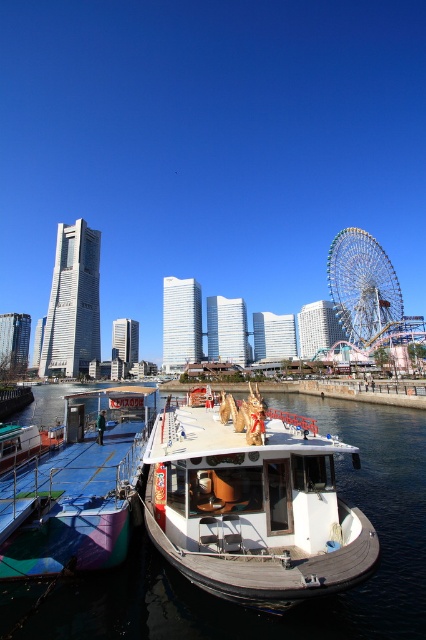
Can you confirm if white matte boat at center is thinner than metallic silver ferris wheel at right?

Yes.

Between point (313, 445) and point (402, 320), which one is positioned behind?

Positioned behind is point (402, 320).

Image resolution: width=426 pixels, height=640 pixels. Find the location of `white matte boat at center`. white matte boat at center is located at coordinates (253, 504).

Is white matte boat at center thinner than multicolored painted boat at lower left?

Indeed, white matte boat at center has a lesser width compared to multicolored painted boat at lower left.

Find the location of `white matte boat at center`. white matte boat at center is located at coordinates pos(253,504).

Is point (192, 520) closer to camera compared to point (11, 573)?

No, it is behind (11, 573).

Find the location of a particular element. white matte boat at center is located at coordinates (253, 504).

Which is behind, point (104, 540) or point (368, 257)?

Positioned behind is point (368, 257).

Which of these two, multicolored painted boat at lower left or metallic silver ferris wheel at right, stands shorter?

Standing shorter between the two is multicolored painted boat at lower left.

Describe the element at coordinates (77, 490) in the screenshot. I see `multicolored painted boat at lower left` at that location.

This screenshot has height=640, width=426. What are the coordinates of `multicolored painted boat at lower left` in the screenshot? It's located at (77, 490).